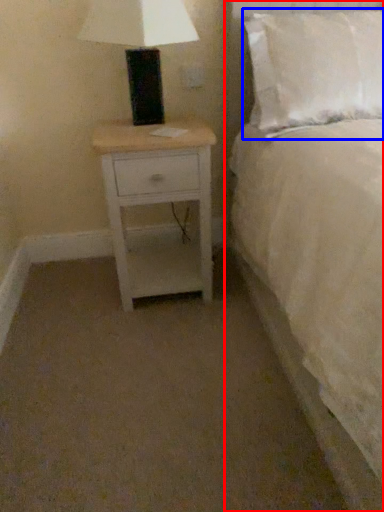
Question: Which point is closer to the camera, bed (highlighted by a red box) or pillow (highlighted by a blue box)?

Choices:
 (A) bed
 (B) pillow

Answer: (A)